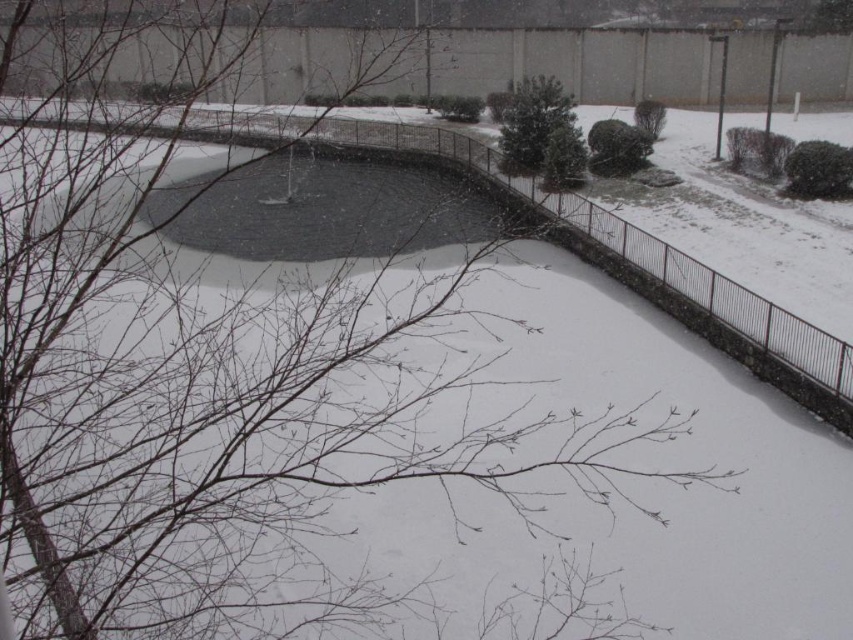
Does green matte tree at center have a smaller size compared to green leafy bush at upper center?

No.

Between point (534, 128) and point (650, 104), which one is positioned behind?

The point (650, 104) is behind.

Locate an element on the screen. Image resolution: width=853 pixels, height=640 pixels. green matte tree at center is located at coordinates (532, 120).

Which is behind, point (527, 157) or point (635, 128)?

Point (635, 128)

Between green matte tree at center and green matte bush at upper center, which one appears on the left side from the viewer's perspective?

green matte tree at center

Does point (521, 109) come closer to viewer compared to point (631, 170)?

No, (521, 109) is behind (631, 170).

This screenshot has height=640, width=853. In order to click on green matte tree at center in this screenshot , I will do `click(532, 120)`.

The image size is (853, 640). What do you see at coordinates (532, 120) in the screenshot?
I see `green matte tree at center` at bounding box center [532, 120].

Identify the location of green matte tree at center. The height and width of the screenshot is (640, 853). (532, 120).